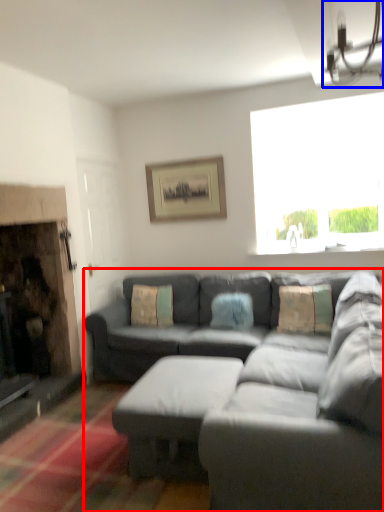
Question: Which object is further to the camera taking this photo, studio couch (highlighted by a red box) or light fixture (highlighted by a blue box)?

Choices:
 (A) studio couch
 (B) light fixture

Answer: (B)